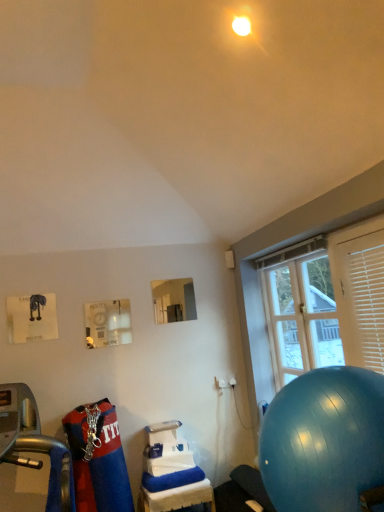
Question: Considering the positions of clear glass window at right and blue rubber ball at lower right in the image, is clear glass window at right wider or thinner than blue rubber ball at lower right?

Choices:
 (A) thin
 (B) wide

Answer: (A)

Question: Relative to blue rubber ball at lower right, is clear glass window at right in front or behind?

Choices:
 (A) behind
 (B) front

Answer: (A)

Question: Which of these objects is positioned closest to the blue rubber ball at lower right?

Choices:
 (A) clear glass window at right
 (B) white plastic blinds at right
 (C) white plastic table at lower center

Answer: (B)

Question: Which object is positioned farthest from the white plastic table at lower center?

Choices:
 (A) white plastic blinds at right
 (B) blue rubber ball at lower right
 (C) clear glass window at right

Answer: (A)